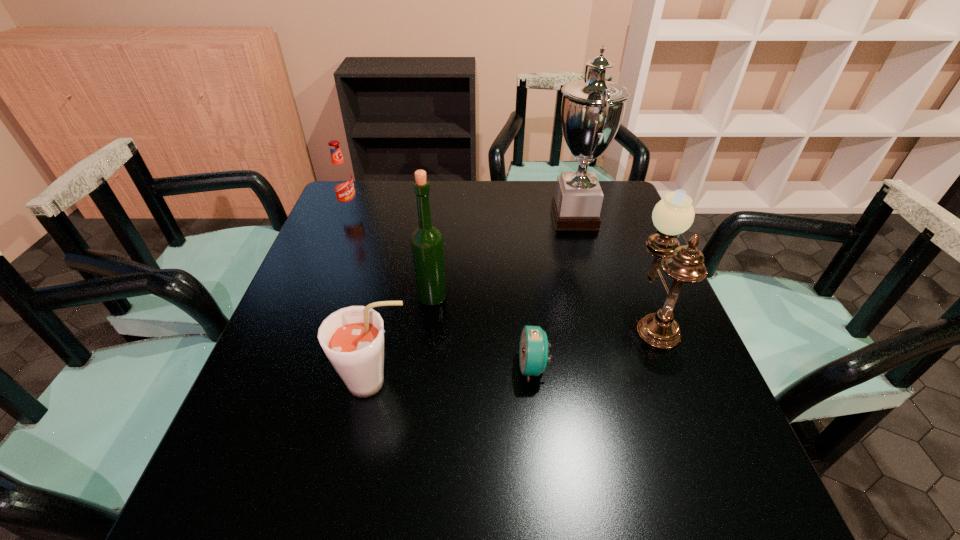
You are a GUI agent. You are given a task and a screenshot of the screen. Output one action in this format:
    pyautogui.click(x=<x>, y=<y>)
    Task: Click on the free space between the tallest object and the oil lamp
    This screenshot has height=540, width=960.
    Given the screenshot: What is the action you would take?
    pyautogui.click(x=613, y=267)

The image size is (960, 540). In order to click on empty space between the right root beer and the liquor in this screenshot , I will do `click(403, 340)`.

The height and width of the screenshot is (540, 960). Find the location of `unoccupied position between the right root beer and the fourth object from left to right`. unoccupied position between the right root beer and the fourth object from left to right is located at coordinates (454, 374).

At what (x,y) coordinates should I click in order to perform the action: click on free space that is in between the nearer root beer and the liquor. Please return your answer as a coordinate pair (x, y). Looking at the image, I should click on (403, 340).

In order to click on vacant region between the oil lamp and the liquor in this screenshot , I will do `click(542, 307)`.

Locate an element on the screen. The image size is (960, 540). vacant area that lies between the liquor and the trophy cup is located at coordinates (503, 257).

Where is `empty space that is in between the right root beer and the liquor`? This screenshot has width=960, height=540. empty space that is in between the right root beer and the liquor is located at coordinates (403, 340).

Locate an element on the screen. This screenshot has height=540, width=960. free space between the tallest object and the farther root beer is located at coordinates (462, 213).

Locate an element on the screen. free spot between the fourth object from left to right and the nearer root beer is located at coordinates (454, 374).

The width and height of the screenshot is (960, 540). In order to click on vacant space in between the liquor and the leftmost object in this screenshot , I will do `click(391, 253)`.